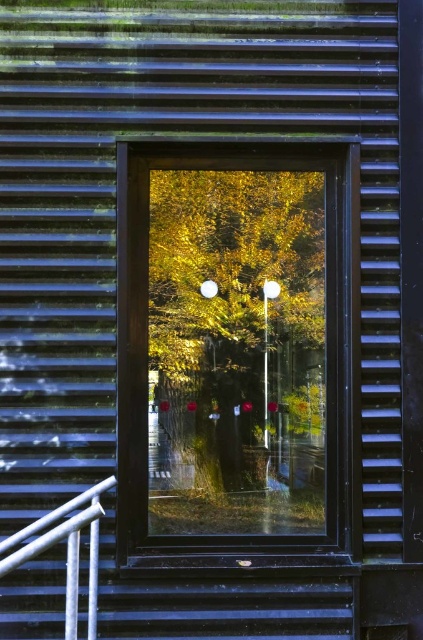
Is golden leafy tree at center to the right of white glossy rail at lower left from the viewer's perspective?

Correct, you'll find golden leafy tree at center to the right of white glossy rail at lower left.

Is point (198, 470) closer to camera compared to point (63, 536)?

No, it is behind (63, 536).

Does point (315, 225) come farther from viewer compared to point (30, 554)?

Yes, it is.

The width and height of the screenshot is (423, 640). I want to click on golden leafy tree at center, so click(236, 326).